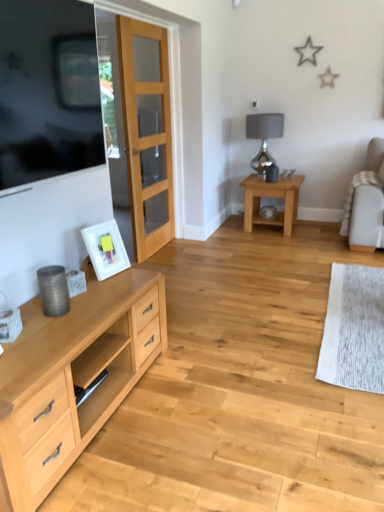
Question: Based on their sizes in the image, would you say silver metallic lamp at upper right is bigger or smaller than matte black tv at left?

Choices:
 (A) big
 (B) small

Answer: (A)

Question: Is point (258, 138) positioned closer to the camera than point (59, 124)?

Choices:
 (A) closer
 (B) farther

Answer: (B)

Question: Which is farther from the clear glass door at center?

Choices:
 (A) white fabric chair at right
 (B) silver metallic lamp at upper right
 (C) light brown wooden table at center-right
 (D) white matte picture frame at left
 (E) matte gray coffee cup at lower left

Answer: (E)

Question: Considering the real-world distances, which object is closest to the white matte picture frame at left?

Choices:
 (A) matte gray coffee cup at lower left
 (B) matte black tv at left
 (C) clear glass door at center
 (D) light brown wooden table at center-right
 (E) white fabric chair at right

Answer: (A)